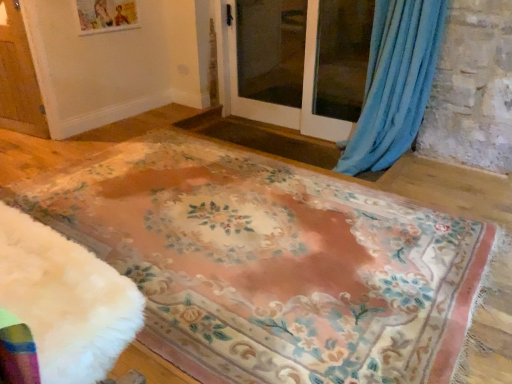
In order to face transparent glass screen door at center, placed as the 1th screen door when sorted from right to left, should I rotate leftwards or rightwards?

Turn right approximately 6.731 degrees to face it.

Locate an element on the screen. floral-patterned carpet at center is located at coordinates (271, 263).

Image resolution: width=512 pixels, height=384 pixels. Find the location of `blue soft fabric curtain at upper right`. blue soft fabric curtain at upper right is located at coordinates (395, 83).

Identify the location of transparent glass screen door at center, placed as the third screen door when sorted from left to right. The width and height of the screenshot is (512, 384). point(300,63).

Visually, is floral-patterned carpet at center positioned to the left or to the right of wooden screen door at left, placed as the first screen door when sorted from left to right?

In the image, floral-patterned carpet at center appears on the right side of wooden screen door at left, placed as the first screen door when sorted from left to right.

How distant is floral-patterned carpet at center from wooden screen door at left, placed as the first screen door when sorted from left to right?

floral-patterned carpet at center is 6.17 feet away from wooden screen door at left, placed as the first screen door when sorted from left to right.

Is wooden screen door at left, arranged as the 3th screen door when viewed from the right, at the back of floral-patterned carpet at center?

No, floral-patterned carpet at center's orientation is not away from wooden screen door at left, arranged as the 3th screen door when viewed from the right.

From a real-world perspective, relative to wooden screen door at left, arranged as the 3th screen door when viewed from the right, is floral-patterned carpet at center vertically above or below?

From a real-world perspective, floral-patterned carpet at center is physically below wooden screen door at left, arranged as the 3th screen door when viewed from the right.

Can you confirm if clear glass screen door at center, the second screen door when ordered from left to right, is shorter than transparent glass screen door at center, placed as the 1th screen door when sorted from right to left?

Correct, clear glass screen door at center, the second screen door when ordered from left to right, is not as tall as transparent glass screen door at center, placed as the 1th screen door when sorted from right to left.

Does clear glass screen door at center, which is the second screen door in right-to-left order, turn towards transparent glass screen door at center, placed as the third screen door when sorted from left to right?

Yes, clear glass screen door at center, which is the second screen door in right-to-left order, faces towards transparent glass screen door at center, placed as the third screen door when sorted from left to right.

From the image's perspective, between clear glass screen door at center, which is the second screen door in right-to-left order, and transparent glass screen door at center, placed as the third screen door when sorted from left to right, who is located below?

transparent glass screen door at center, placed as the third screen door when sorted from left to right.

From a real-world perspective, which object stands above the other?

In real-world perspective, transparent glass screen door at center, placed as the 1th screen door when sorted from right to left, is above.

How much distance is there between blue soft fabric curtain at upper right and wooden screen door at left, arranged as the 3th screen door when viewed from the right?

8.73 feet.

Can you confirm if blue soft fabric curtain at upper right is positioned to the right of wooden screen door at left, placed as the first screen door when sorted from left to right?

Yes.

Does blue soft fabric curtain at upper right have a greater height compared to wooden screen door at left, placed as the first screen door when sorted from left to right?

Yes, blue soft fabric curtain at upper right is taller than wooden screen door at left, placed as the first screen door when sorted from left to right.

Is blue soft fabric curtain at upper right next to wooden screen door at left, placed as the first screen door when sorted from left to right, and touching it?

No, blue soft fabric curtain at upper right is not touching wooden screen door at left, placed as the first screen door when sorted from left to right.

Is blue soft fabric curtain at upper right positioned beyond the bounds of transparent glass screen door at center, placed as the third screen door when sorted from left to right?

Actually, blue soft fabric curtain at upper right is at least partially inside transparent glass screen door at center, placed as the third screen door when sorted from left to right.

Based on the photo, does blue soft fabric curtain at upper right have a lesser height compared to transparent glass screen door at center, placed as the 1th screen door when sorted from right to left?

Incorrect, the height of blue soft fabric curtain at upper right does not fall short of that of transparent glass screen door at center, placed as the 1th screen door when sorted from right to left.

Is point (384, 54) less distant than point (320, 100)?

Yes, point (384, 54) is closer to viewer.

Where is `the 2nd screen door to the right when counting from the wooden screen door at left, arranged as the 3th screen door when viewed from the right`? the 2nd screen door to the right when counting from the wooden screen door at left, arranged as the 3th screen door when viewed from the right is located at coordinates (300, 63).

Is transparent glass screen door at center, placed as the third screen door when sorted from left to right, bigger or smaller than wooden screen door at left, arranged as the 3th screen door when viewed from the right?

In the image, transparent glass screen door at center, placed as the third screen door when sorted from left to right, appears to be larger than wooden screen door at left, arranged as the 3th screen door when viewed from the right.

From the image's perspective, would you say transparent glass screen door at center, placed as the third screen door when sorted from left to right, is shown under wooden screen door at left, arranged as the 3th screen door when viewed from the right?

No, from the image's perspective, transparent glass screen door at center, placed as the third screen door when sorted from left to right, is not below wooden screen door at left, arranged as the 3th screen door when viewed from the right.

Is wooden screen door at left, placed as the first screen door when sorted from left to right, at the back of transparent glass screen door at center, placed as the 1th screen door when sorted from right to left?

No, wooden screen door at left, placed as the first screen door when sorted from left to right, is not at the back of transparent glass screen door at center, placed as the 1th screen door when sorted from right to left.

Is clear glass screen door at center, the second screen door when ordered from left to right, located outside blue soft fabric curtain at upper right?

Yes, clear glass screen door at center, the second screen door when ordered from left to right, is outside of blue soft fabric curtain at upper right.

Between clear glass screen door at center, the second screen door when ordered from left to right, and blue soft fabric curtain at upper right, which one has larger width?

With larger width is clear glass screen door at center, the second screen door when ordered from left to right.

Is clear glass screen door at center, the second screen door when ordered from left to right, shorter than blue soft fabric curtain at upper right?

Correct, clear glass screen door at center, the second screen door when ordered from left to right, is not as tall as blue soft fabric curtain at upper right.

Considering the positions of points (233, 9) and (344, 157), is point (233, 9) farther from camera compared to point (344, 157)?

That is True.

Is transparent glass screen door at center, placed as the third screen door when sorted from left to right, bigger or smaller than clear glass screen door at center, the second screen door when ordered from left to right?

transparent glass screen door at center, placed as the third screen door when sorted from left to right, is bigger than clear glass screen door at center, the second screen door when ordered from left to right.

Is transparent glass screen door at center, placed as the 1th screen door when sorted from right to left, next to clear glass screen door at center, the second screen door when ordered from left to right, and touching it?

Yes, transparent glass screen door at center, placed as the 1th screen door when sorted from right to left, is beside clear glass screen door at center, the second screen door when ordered from left to right.

From a real-world perspective, who is located lower, transparent glass screen door at center, placed as the 1th screen door when sorted from right to left, or clear glass screen door at center, which is the second screen door in right-to-left order?

clear glass screen door at center, which is the second screen door in right-to-left order.

I want to click on screen door on the left of floral-patterned carpet at center, so click(18, 77).

From the image's perspective, starting from the clear glass screen door at center, which is the second screen door in right-to-left order, which screen door is the 1st one below? Please provide its 2D coordinates.

[(300, 63)]

Estimate the real-world distances between objects in this image. Which object is closer to blue soft fabric curtain at upper right, clear glass screen door at center, which is the second screen door in right-to-left order, or wooden screen door at left, arranged as the 3th screen door when viewed from the right?

Among the two, clear glass screen door at center, which is the second screen door in right-to-left order, is located nearer to blue soft fabric curtain at upper right.

Looking at the image, which one is located closer to floral-patterned carpet at center, transparent glass screen door at center, placed as the third screen door when sorted from left to right, or blue soft fabric curtain at upper right?

blue soft fabric curtain at upper right is positioned closer to the anchor floral-patterned carpet at center.

Based on their spatial positions, is floral-patterned carpet at center or blue soft fabric curtain at upper right further from clear glass screen door at center, the second screen door when ordered from left to right?

Among the two, floral-patterned carpet at center is located further to clear glass screen door at center, the second screen door when ordered from left to right.

Which object lies nearer to the anchor point transparent glass screen door at center, placed as the 1th screen door when sorted from right to left, wooden screen door at left, placed as the first screen door when sorted from left to right, or floral-patterned carpet at center?

floral-patterned carpet at center is positioned closer to the anchor transparent glass screen door at center, placed as the 1th screen door when sorted from right to left.

Based on their spatial positions, is clear glass screen door at center, which is the second screen door in right-to-left order, or transparent glass screen door at center, placed as the 1th screen door when sorted from right to left, closer to blue soft fabric curtain at upper right?

transparent glass screen door at center, placed as the 1th screen door when sorted from right to left.

Which object lies further to the anchor point wooden screen door at left, arranged as the 3th screen door when viewed from the right, transparent glass screen door at center, placed as the third screen door when sorted from left to right, or blue soft fabric curtain at upper right?

The object further to wooden screen door at left, arranged as the 3th screen door when viewed from the right, is blue soft fabric curtain at upper right.

Which object lies nearer to the anchor point wooden screen door at left, arranged as the 3th screen door when viewed from the right, transparent glass screen door at center, placed as the 1th screen door when sorted from right to left, or floral-patterned carpet at center?

The object closer to wooden screen door at left, arranged as the 3th screen door when viewed from the right, is floral-patterned carpet at center.

Based on the photo, looking at the image, which one is located closer to floral-patterned carpet at center, transparent glass screen door at center, placed as the third screen door when sorted from left to right, or wooden screen door at left, placed as the first screen door when sorted from left to right?

transparent glass screen door at center, placed as the third screen door when sorted from left to right, lies closer to floral-patterned carpet at center than the other object.

The height and width of the screenshot is (384, 512). I want to click on screen door between clear glass screen door at center, the second screen door when ordered from left to right, and blue soft fabric curtain at upper right, so click(300, 63).

Image resolution: width=512 pixels, height=384 pixels. I want to click on mat located between wooden screen door at left, arranged as the 3th screen door when viewed from the right, and transparent glass screen door at center, placed as the third screen door when sorted from left to right, in the left-right direction, so click(271, 263).

Where is `mat between wooden screen door at left, placed as the first screen door when sorted from left to right, and blue soft fabric curtain at upper right, in the horizontal direction`? mat between wooden screen door at left, placed as the first screen door when sorted from left to right, and blue soft fabric curtain at upper right, in the horizontal direction is located at coordinates (271, 263).

I want to click on screen door positioned between floral-patterned carpet at center and blue soft fabric curtain at upper right from near to far, so click(300, 63).